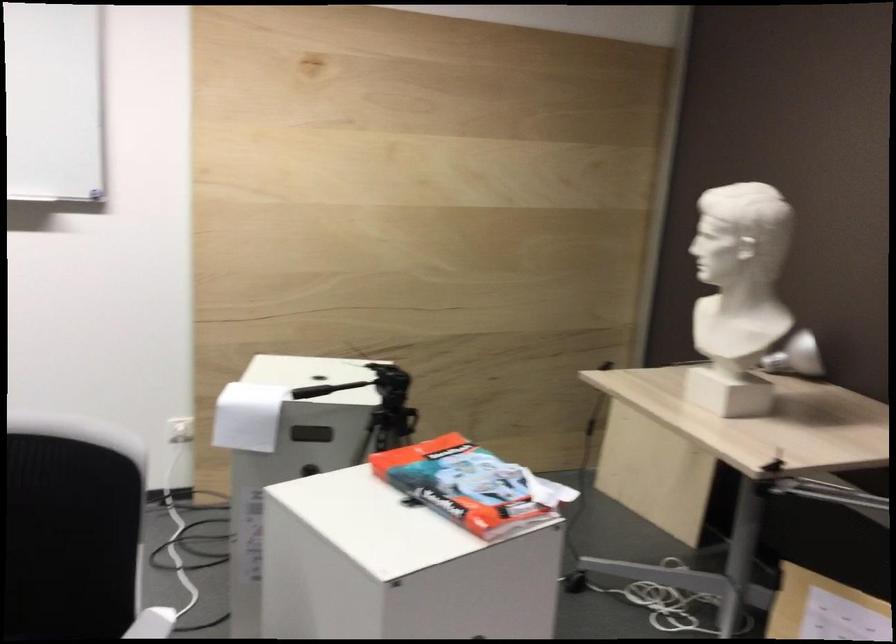
Describe the element at coordinates (795, 357) in the screenshot. I see `the silver lamp head` at that location.